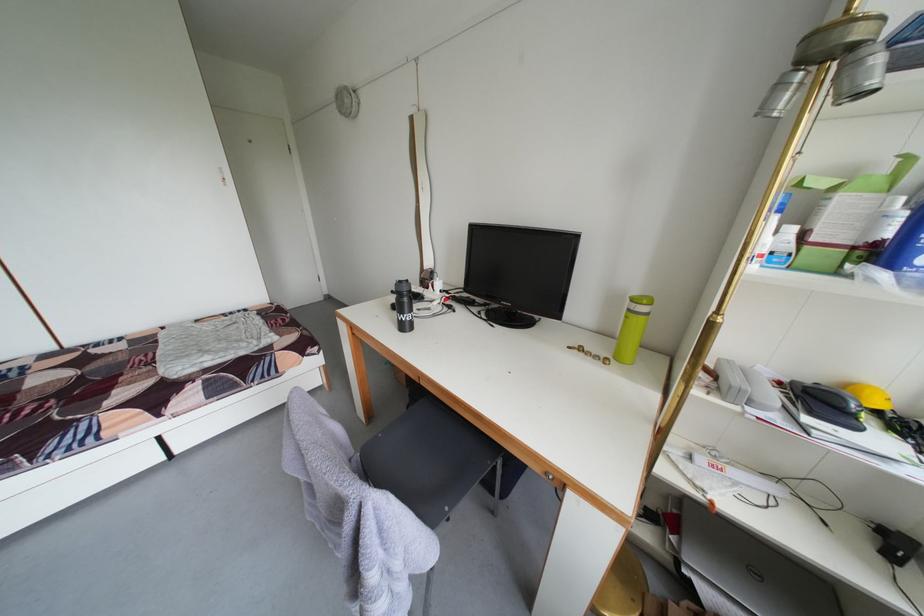
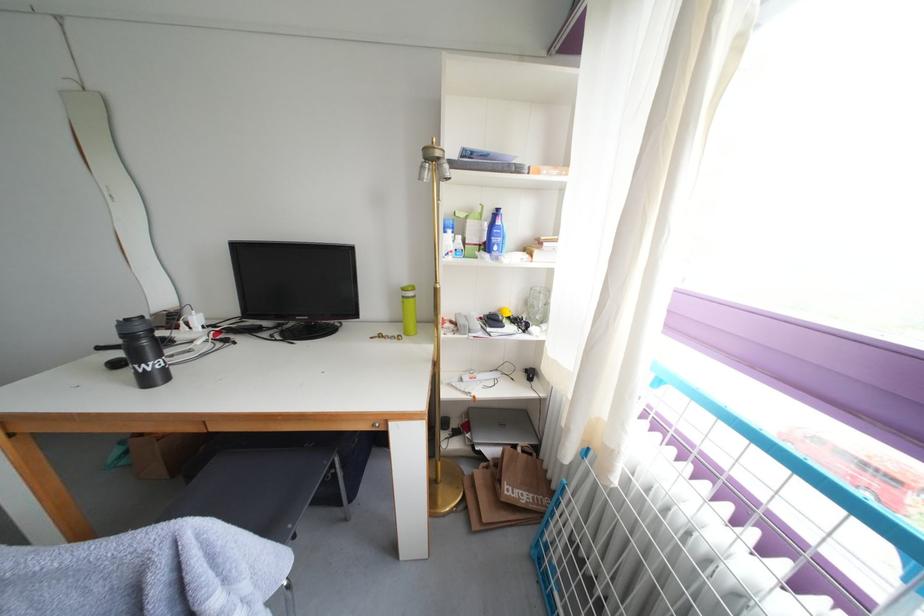
Where in the second image is the point corresponding to [643,305] from the first image?

(414, 294)